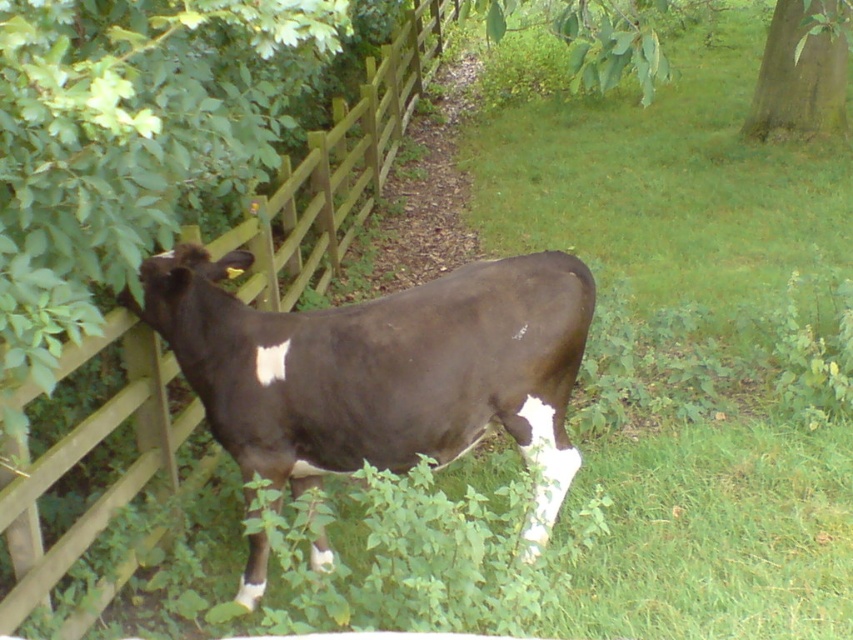
Question: Considering the real-world distances, which object is closest to the green rough bark tree at upper right?

Choices:
 (A) dark brown cow at center
 (B) wooden at left

Answer: (B)

Question: Can you confirm if dark brown cow at center is positioned above wooden at left?

Choices:
 (A) no
 (B) yes

Answer: (A)

Question: Is dark brown cow at center to the left of wooden at left from the viewer's perspective?

Choices:
 (A) yes
 (B) no

Answer: (B)

Question: Estimate the real-world distances between objects in this image. Which object is farther from the dark brown cow at center?

Choices:
 (A) green rough bark tree at upper right
 (B) wooden at left

Answer: (A)

Question: Estimate the real-world distances between objects in this image. Which object is farther from the green rough bark tree at upper right?

Choices:
 (A) wooden at left
 (B) dark brown cow at center

Answer: (B)

Question: Is dark brown cow at center to the right of green rough bark tree at upper right from the viewer's perspective?

Choices:
 (A) yes
 (B) no

Answer: (B)